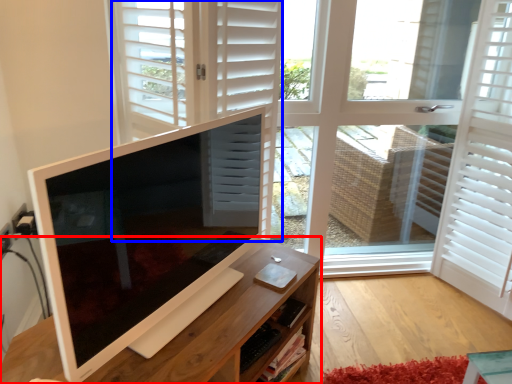
Question: Which object is closer to the camera taking this photo, desk (highlighted by a red box) or door (highlighted by a blue box)?

Choices:
 (A) desk
 (B) door

Answer: (A)